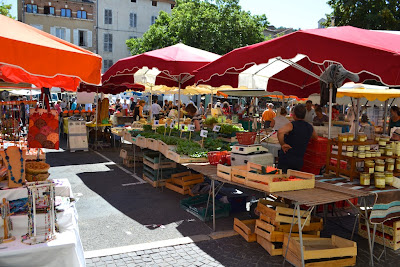
Where is `table`? table is located at coordinates (301, 194), (370, 185), (214, 171), (174, 155), (133, 136), (42, 201), (85, 122).